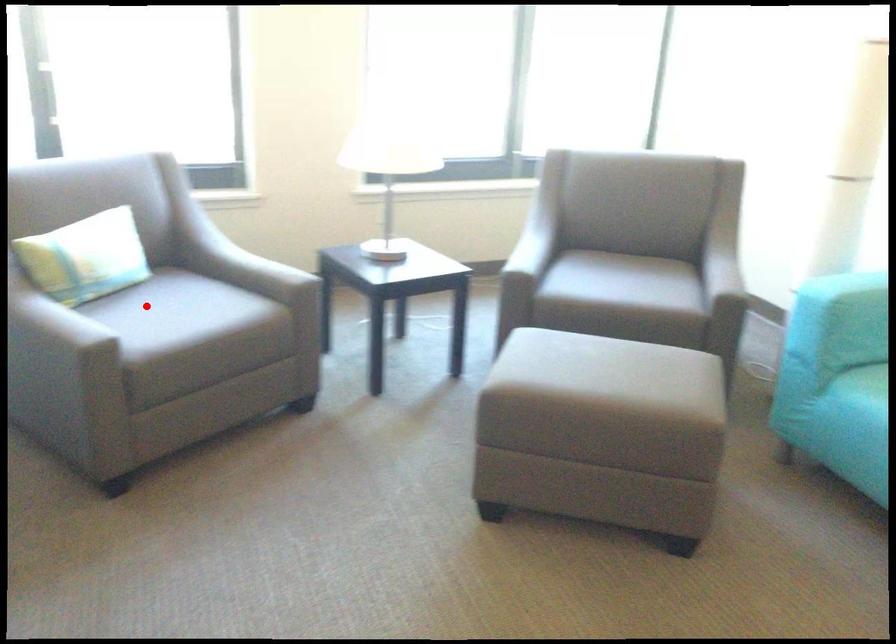
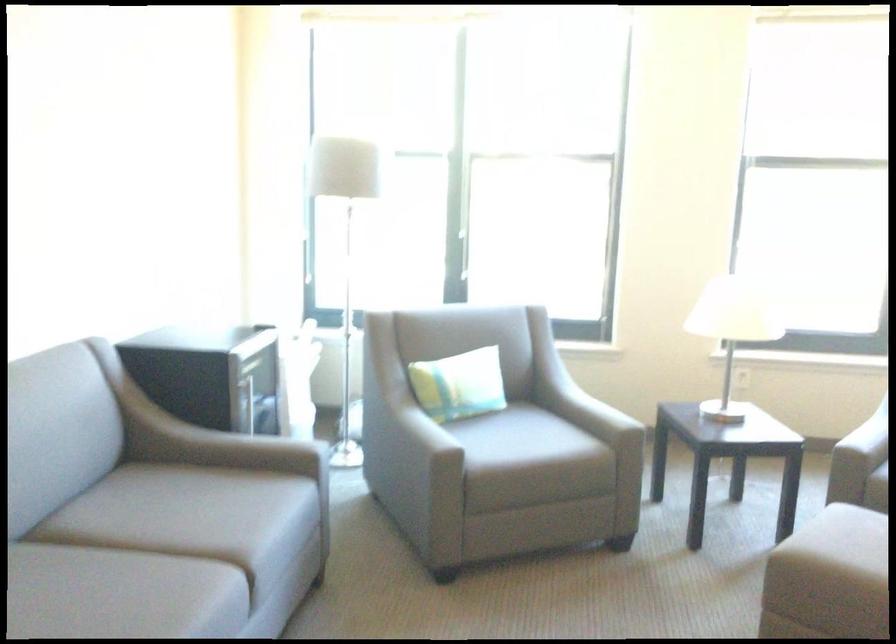
Where in the second image is the point corresponding to the highlighted location from the first image?

(495, 431)